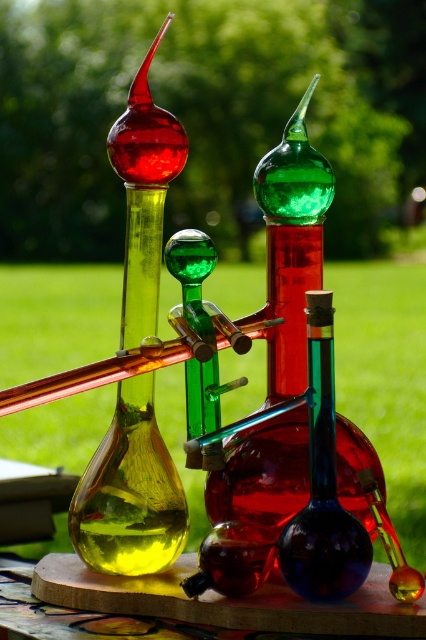
Question: Does green glass bottle at center have a larger size compared to wooden board at center?

Choices:
 (A) no
 (B) yes

Answer: (B)

Question: Estimate the real-world distances between objects in this image. Which object is closer to the blue glass bottle at center?

Choices:
 (A) matte glass bottle at left
 (B) green glass bottle at center
 (C) wooden board at center

Answer: (B)

Question: Can you confirm if matte glass bottle at left is positioned above blue glass bottle at center?

Choices:
 (A) no
 (B) yes

Answer: (B)

Question: Is the position of green glass bottle at center less distant than that of matte glass bottle at left?

Choices:
 (A) yes
 (B) no

Answer: (A)

Question: Estimate the real-world distances between objects in this image. Which object is farther from the green glass bottle at center?

Choices:
 (A) blue glass bottle at center
 (B) matte glass bottle at left

Answer: (B)

Question: Which of the following is the closest to the observer?

Choices:
 (A) (215, 500)
 (B) (39, 605)
 (C) (293, 588)

Answer: (C)